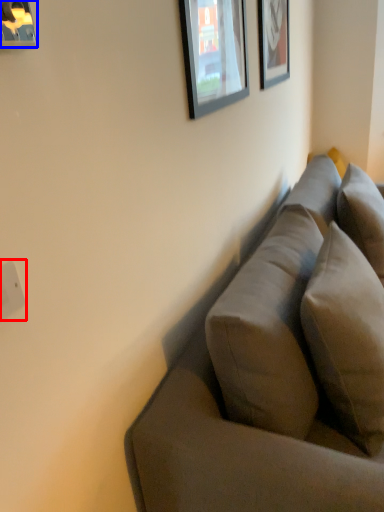
Question: Among these objects, which one is farthest to the camera, electric outlet (highlighted by a red box) or picture frame (highlighted by a blue box)?

Choices:
 (A) electric outlet
 (B) picture frame

Answer: (A)